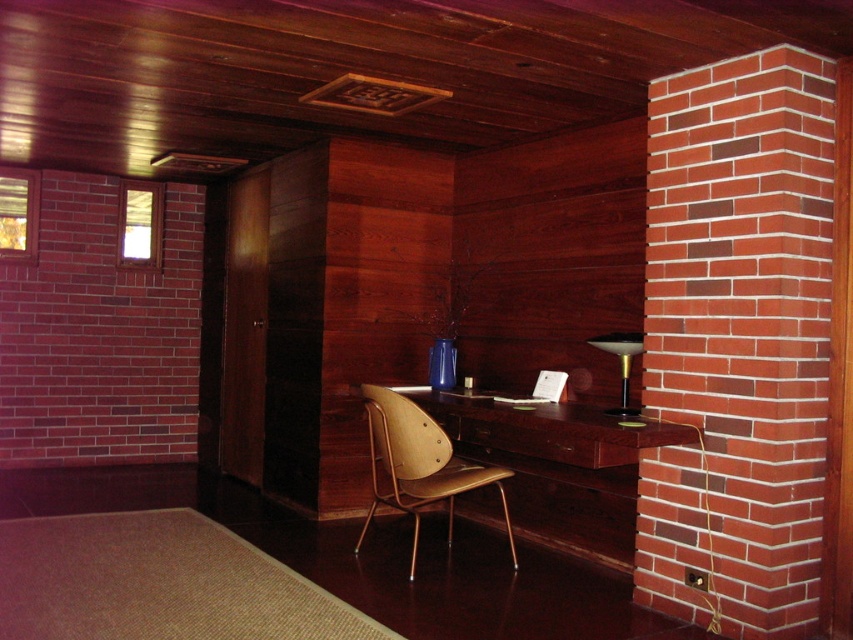
You are organizing a small meeting in the cozy interior space described. You need to place a 1.5 meter long rectangular tablecloth on either the brown wood desk at center or the matte wood chair at center. Which object can accommodate the tablecloth without it hanging off the edges?

The brown wood desk at center has a larger size compared to the matte wood chair at center, so the tablecloth will fit better on the brown wood desk at center.

You are standing in the room and want to sit down. Which object at point (419, 464) is the best option for seating?

The point (419, 464) corresponds to the matte wood chair at center, which is the best option for seating.